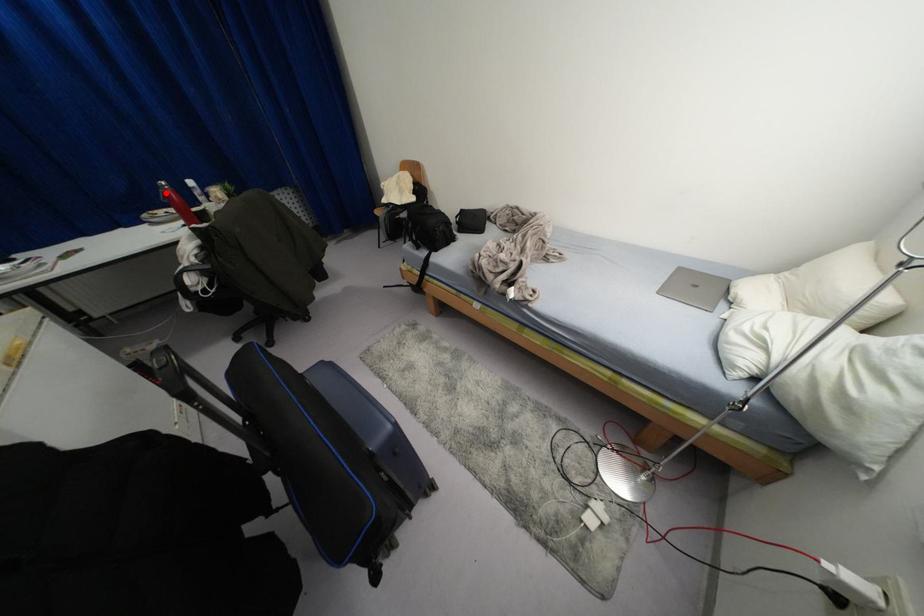
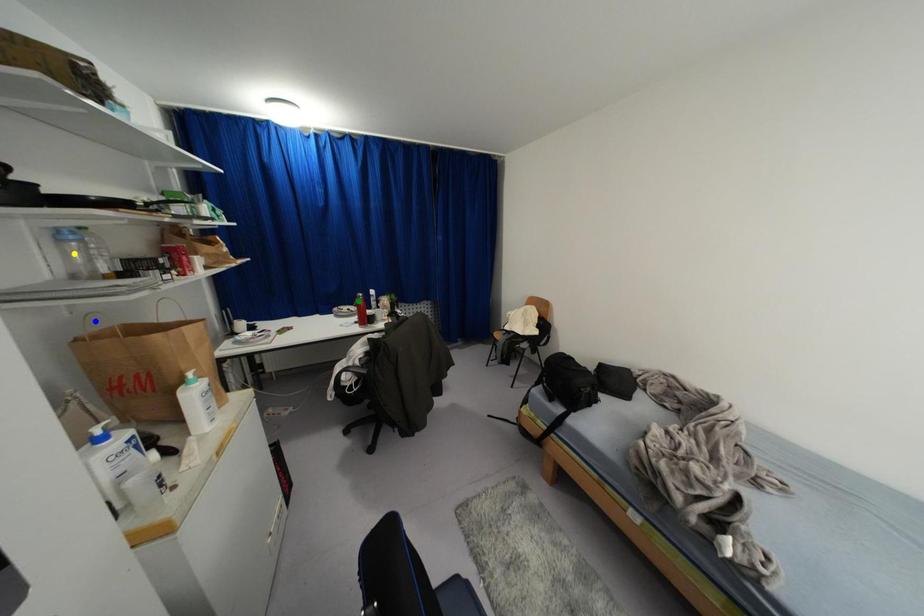
Question: I am providing you with two images of the same scene from different viewpoints. A red point is marked on the first image. You are given multiple points on the second image. Which point in image 2 represents the same 3d spot as the red point in image 1?

Choices:
 (A) green point
 (B) yellow point
 (C) blue point

Answer: (A)